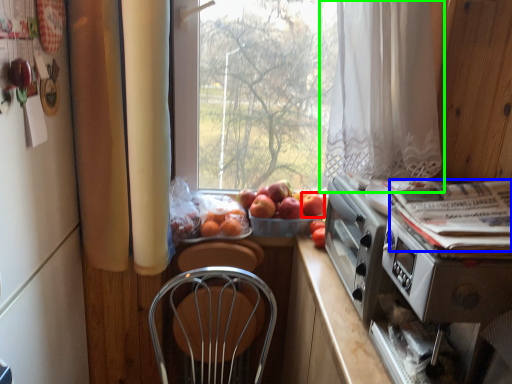
Question: Which object is positioned closest to apple (highlighted by a red box)? Select from magazine (highlighted by a blue box) and curtain (highlighted by a green box).

Choices:
 (A) magazine
 (B) curtain

Answer: (B)